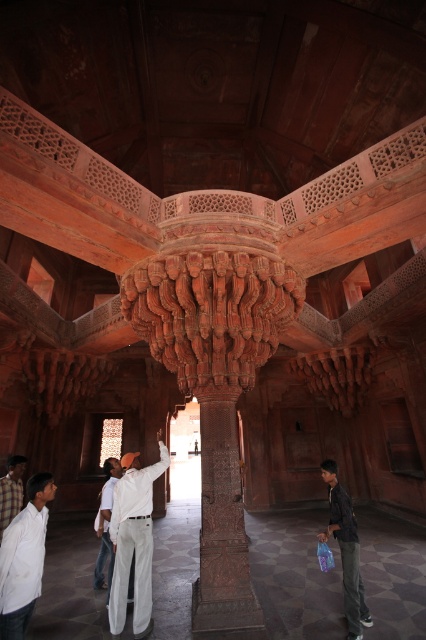
Based on the photo, you are a fashion designer visiting this historical monument. You notice the white cotton pants at center and the dark gray jeans at lower right. Which of these two items of clothing is bigger in size?

The white cotton pants at center has a larger size compared to dark gray jeans at lower right.

You are an interior designer planning to install a new lighting fixture. You notice the carved stone column at center and the white cotton pants at center. Which object is positioned higher in the scene?

The carved stone column at center is located above the white cotton pants at center, so it is positioned higher in the scene.

You are standing inside a historical monument and want to take a photo of the carved stone column at center. If your camera has a maximum focus range of 4 meters, will it be able to capture the column clearly?

The carved stone column at center is 4.48 meters away from viewer, which exceeds the camera maximum focus range of 4 meters. Therefore, the camera cannot capture the column clearly.